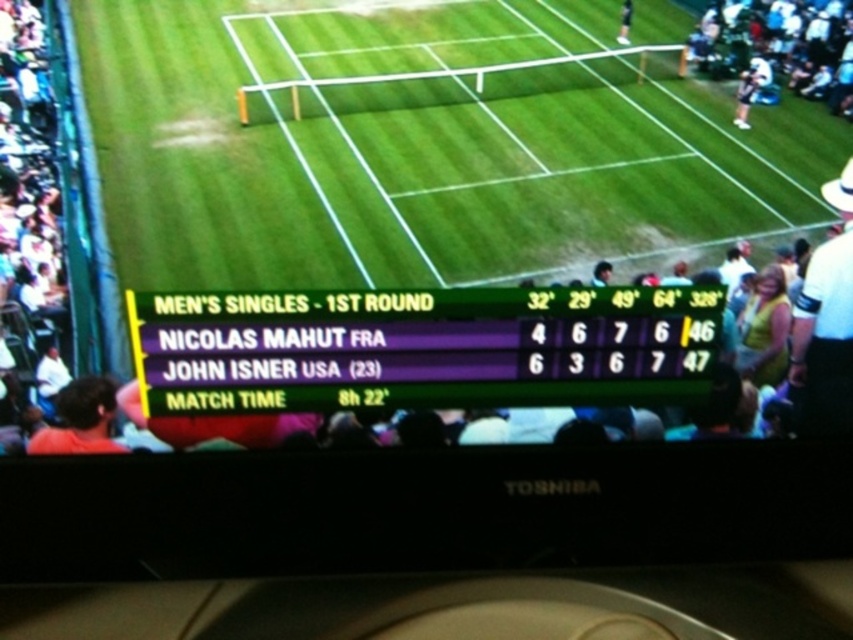
Question: Which is nearer to the brown hair at lower left?

Choices:
 (A) white hat at upper right
 (B) green plastic scoreboard at center
 (C) green grass tennis court at center

Answer: (B)

Question: Estimate the real-world distances between objects in this image. Which object is closer to the brown hair at lower left?

Choices:
 (A) green plastic scoreboard at center
 (B) white hat at upper right

Answer: (A)

Question: Which object is the closest to the green grass tennis court at center?

Choices:
 (A) white hat at upper right
 (B) brown hair at lower left

Answer: (A)

Question: Does green grass tennis court at center appear under brown hair at lower left?

Choices:
 (A) yes
 (B) no

Answer: (B)

Question: Does green grass tennis court at center appear over white hat at upper right?

Choices:
 (A) no
 (B) yes

Answer: (B)

Question: Is green grass tennis court at center above white hat at upper right?

Choices:
 (A) no
 (B) yes

Answer: (B)